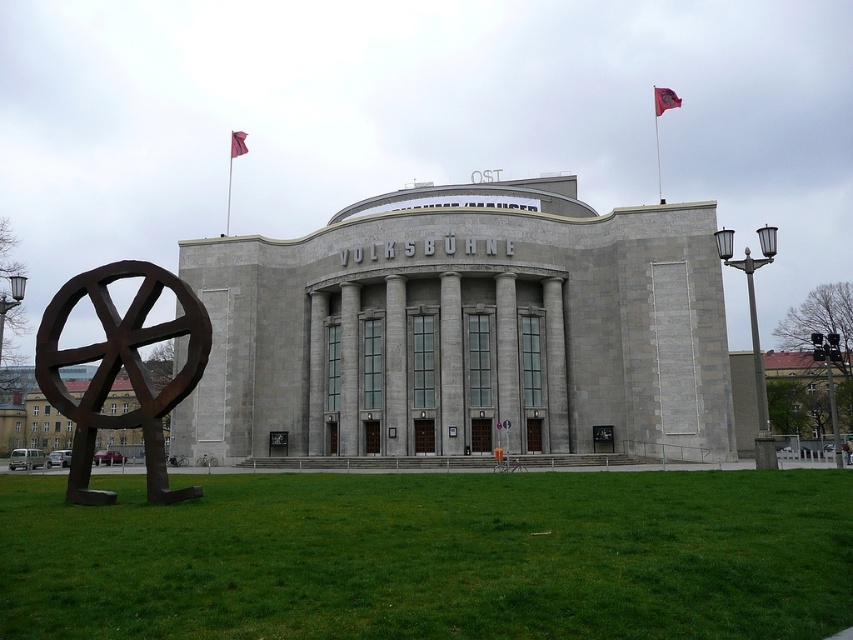
You are standing in front of the building and want to find the rusty metal sculpture at center. According to the coordinates, where should you look relative to the building?

The rusty metal sculpture at center is located at coordinates point [119,369], which means it is positioned to the right and slightly below the center point of the building.